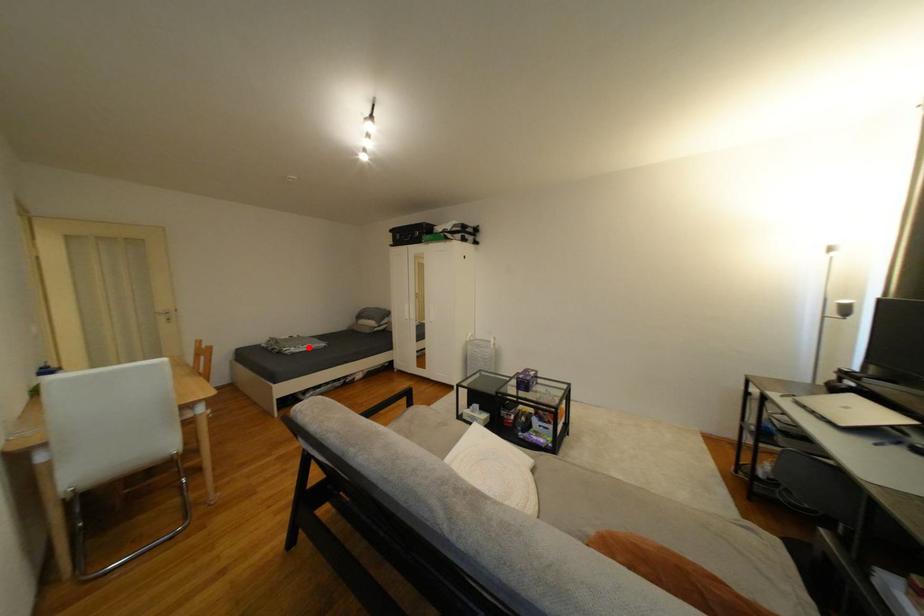
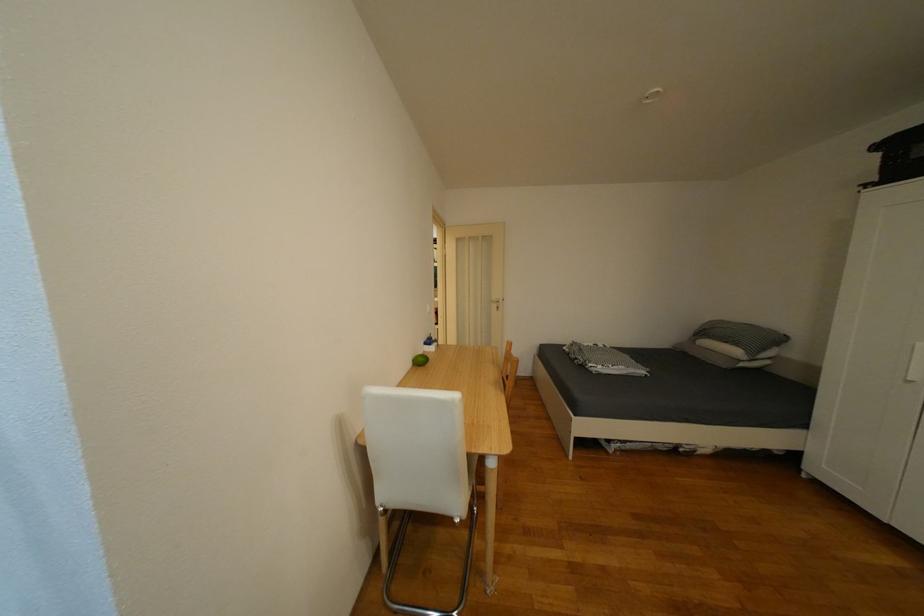
Question: I am providing you with two images of the same scene from different viewpoints. A red point is marked on the first image. Can you still see the location of the red point in image 2?

Choices:
 (A) Yes
 (B) No

Answer: (A)